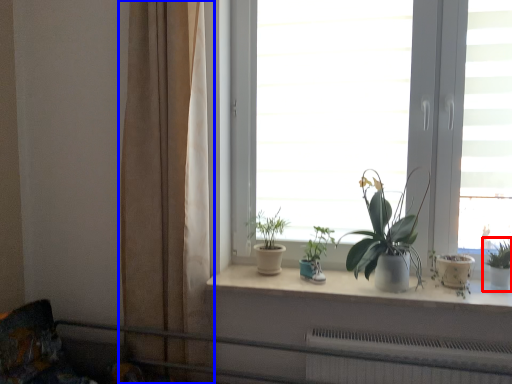
Question: Which object is closer to the camera taking this photo, houseplant (highlighted by a red box) or curtain (highlighted by a blue box)?

Choices:
 (A) houseplant
 (B) curtain

Answer: (B)